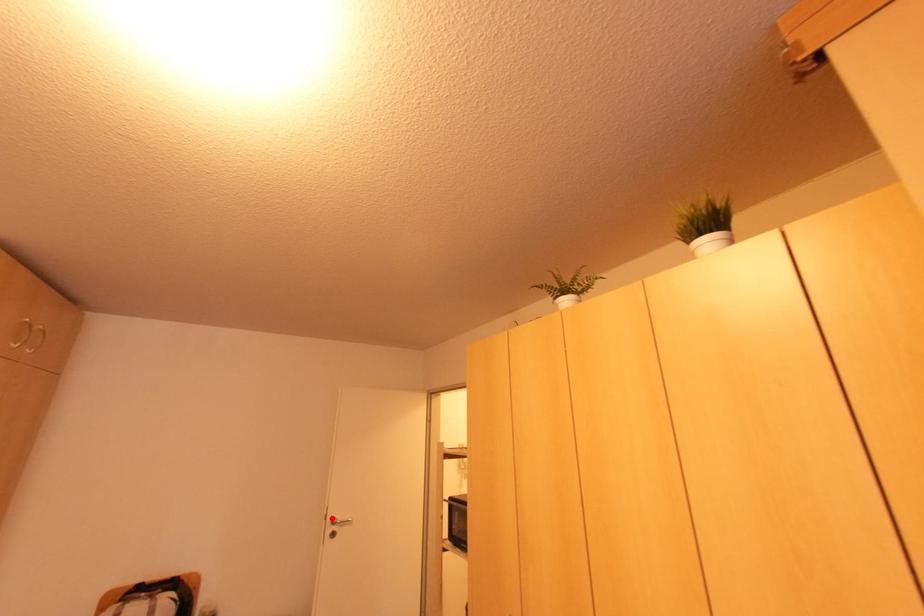
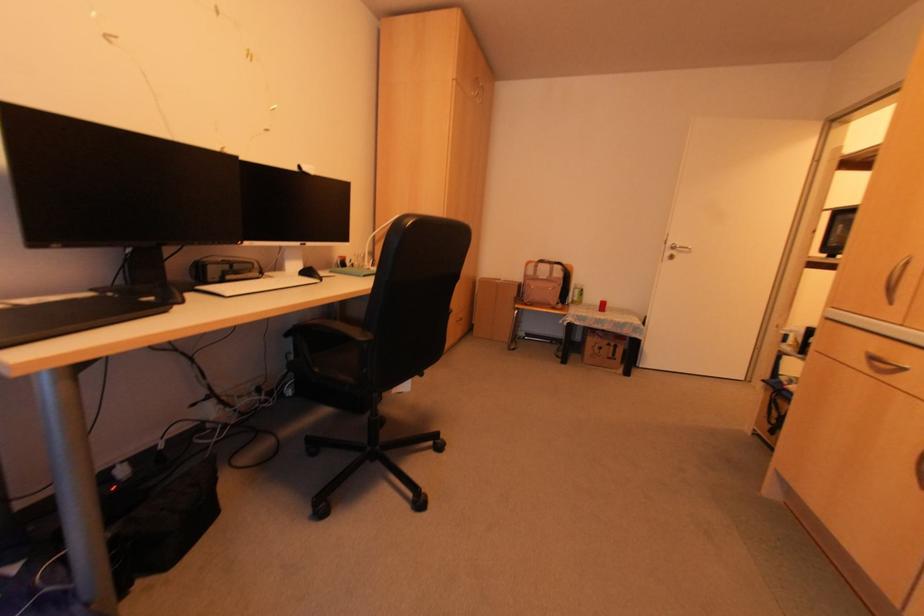
Question: I am providing you with two images of the same scene from different viewpoints. A red point is shown in image1. For the corresponding object point in image2, is it positioned nearer or farther from the camera?

Choices:
 (A) Nearer
 (B) Farther

Answer: (A)